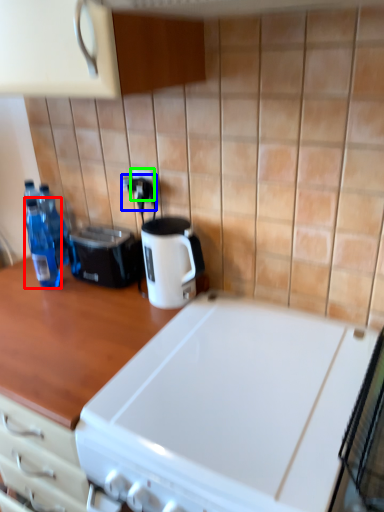
Question: Which object is the closest to the bottle (highlighted by a red box)? Choose among these: electric outlet (highlighted by a blue box) or electric outlet (highlighted by a green box).

Choices:
 (A) electric outlet
 (B) electric outlet

Answer: (A)